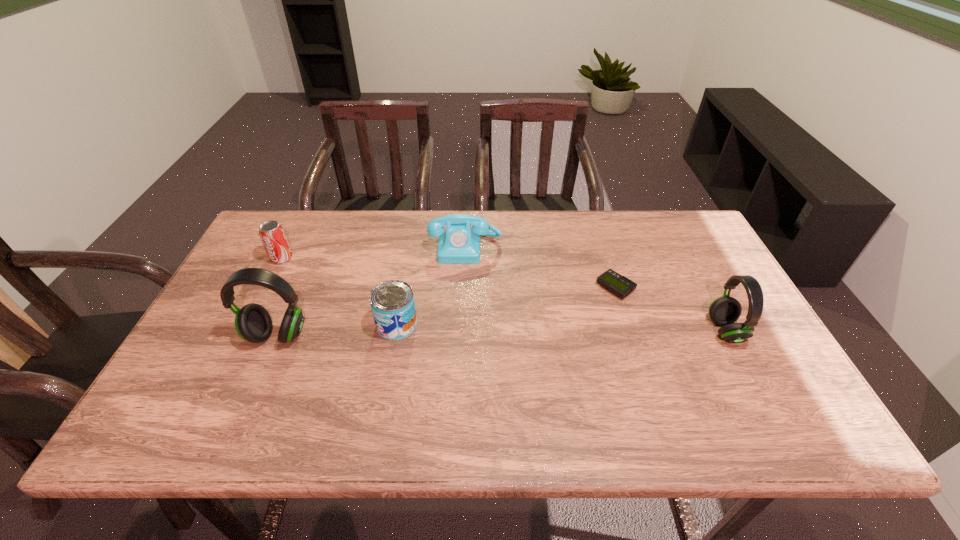
In the image, there is a desktop. Find the location of `vacant region at the far edge`. vacant region at the far edge is located at coordinates (321, 237).

This screenshot has height=540, width=960. What are the coordinates of `free space at the left edge of the desktop` in the screenshot? It's located at (252, 262).

Locate an element on the screen. This screenshot has width=960, height=540. vacant space at the right edge of the desktop is located at coordinates (707, 279).

In the image, there is a desktop. Identify the location of free space at the far left corner. Image resolution: width=960 pixels, height=540 pixels. (256, 250).

You are a GUI agent. You are given a task and a screenshot of the screen. Output one action in this format:
    pyautogui.click(x=<x>, y=<y>)
    Task: Click on the vacant region at the far right corner of the desktop
    
    Given the screenshot: What is the action you would take?
    coord(701,240)

At what (x,y) coordinates should I click in order to perform the action: click on free space at the near right corner. Please return your answer as a coordinate pair (x, y). This screenshot has width=960, height=540. Looking at the image, I should click on (777, 381).

Find the location of a particular element. This screenshot has height=540, width=960. vacant region between the third object from left to right and the third object from right to left is located at coordinates (431, 286).

The height and width of the screenshot is (540, 960). Find the location of `free space between the shortest object and the soda can`. free space between the shortest object and the soda can is located at coordinates (448, 273).

In order to click on unoccupied position between the second object from right to left and the fourth object from right to left in this screenshot , I will do `click(506, 306)`.

Image resolution: width=960 pixels, height=540 pixels. I want to click on unoccupied position between the third object from right to left and the shorter headset, so click(x=595, y=289).